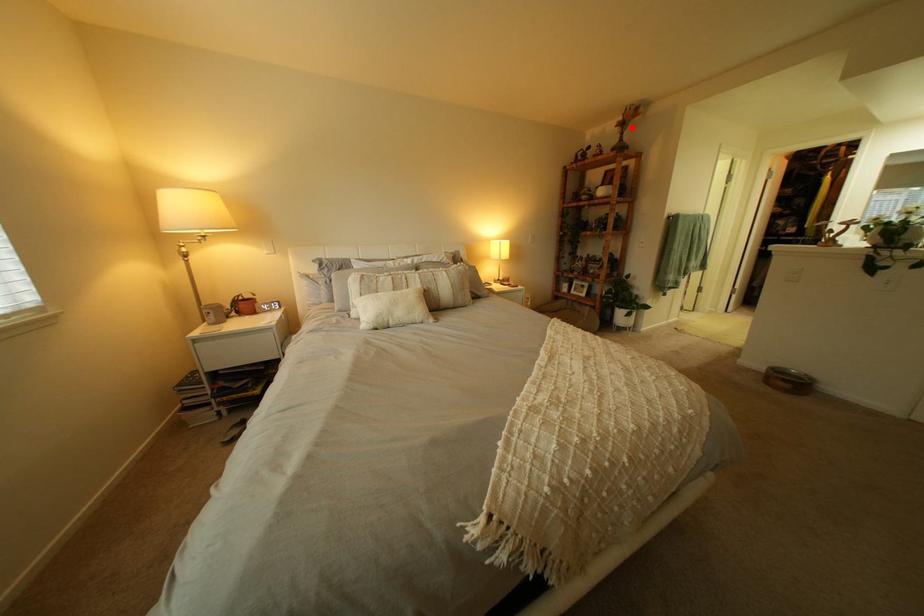
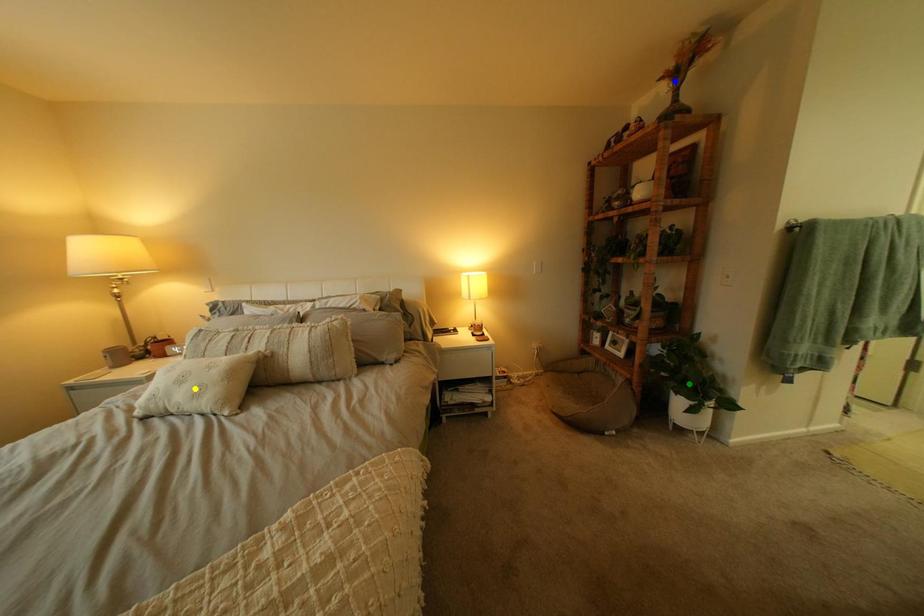
Question: I am providing you with two images of the same scene from different viewpoints. A red point is marked on the first image. You are given multiple points on the second image. Which point in image 2 represents the same 3d spot as the red point in image 1?

Choices:
 (A) green point
 (B) blue point
 (C) yellow point

Answer: (B)